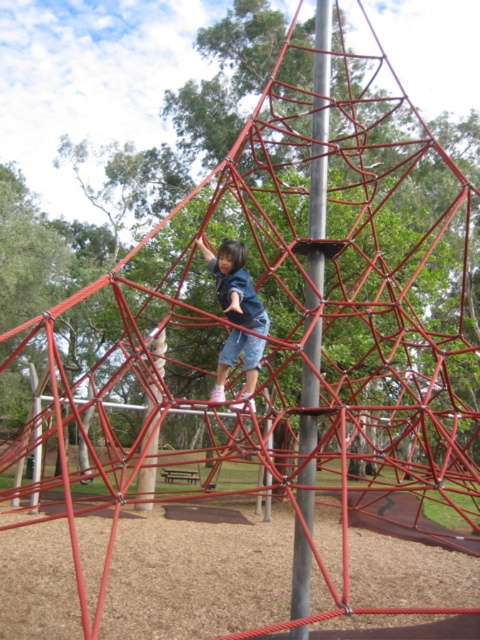
Who is taller, metallic pole at center or matte blue shorts at center?

metallic pole at center is taller.

Is metallic pole at center above matte blue shorts at center?

Yes.

Who is more forward, [290,634] or [222,285]?

Positioned in front is point [222,285].

You are a GUI agent. You are given a task and a screenshot of the screen. Output one action in this format:
    pyautogui.click(x=<x>, y=<y>)
    Task: Click on the metallic pole at center
    
    Given the screenshot: What is the action you would take?
    pyautogui.click(x=312, y=312)